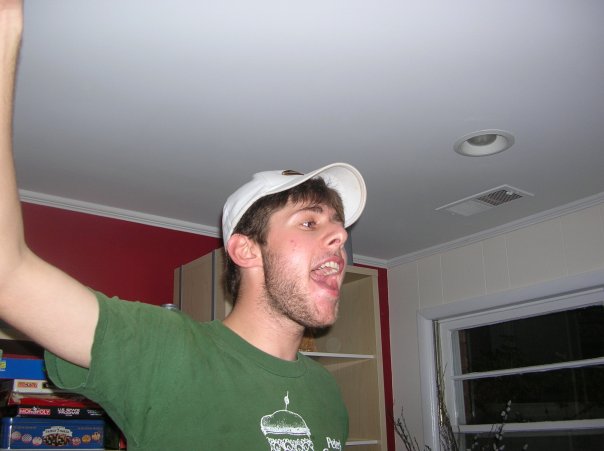
Locate an element on the screen. plant is located at coordinates (451, 442).